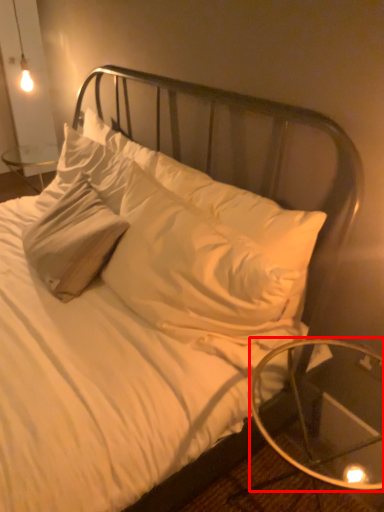
Question: In this image, where is table (annotated by the red box) located relative to pillow?

Choices:
 (A) left
 (B) right

Answer: (B)